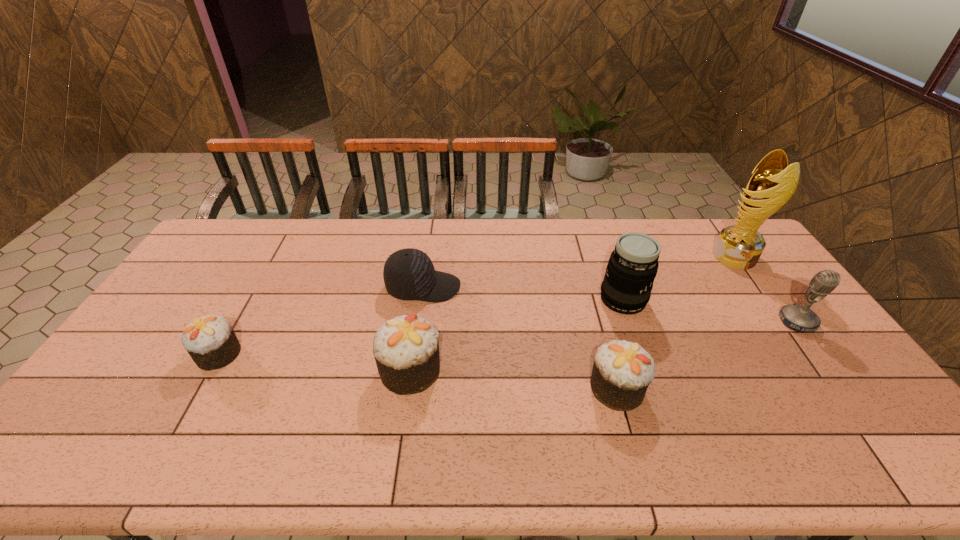
Locate an element on the screen. The width and height of the screenshot is (960, 540). the leftmost cupcake is located at coordinates coord(210,340).

In order to click on the leftmost object in this screenshot , I will do `click(210, 340)`.

At what (x,y) coordinates should I click in order to perform the action: click on the second cupcake from right to left. Please return your answer as a coordinate pair (x, y). Looking at the image, I should click on (406, 348).

Find the location of a particular element. Image resolution: width=960 pixels, height=540 pixels. the rightmost cupcake is located at coordinates (622, 371).

The image size is (960, 540). I want to click on telephoto lens, so click(633, 265).

Image resolution: width=960 pixels, height=540 pixels. I want to click on the tallest object, so click(739, 246).

What are the coordinates of `the farthest object` in the screenshot? It's located at (739, 246).

In order to click on baseball cap in this screenshot , I will do `click(409, 274)`.

The width and height of the screenshot is (960, 540). In order to click on microphone in this screenshot , I will do `click(799, 318)`.

Find the location of a particular element. free space located 0.110m on the left of the leftmost object is located at coordinates (158, 354).